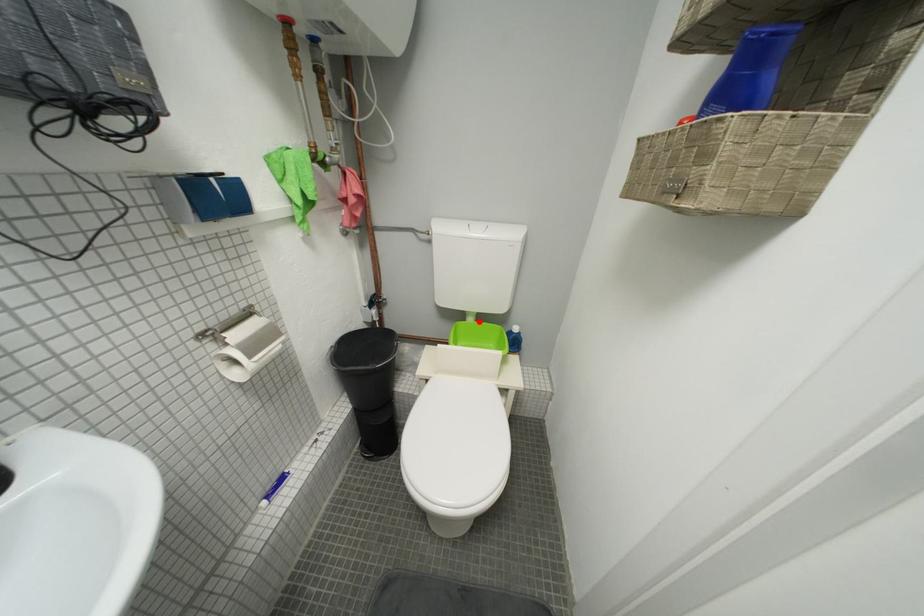
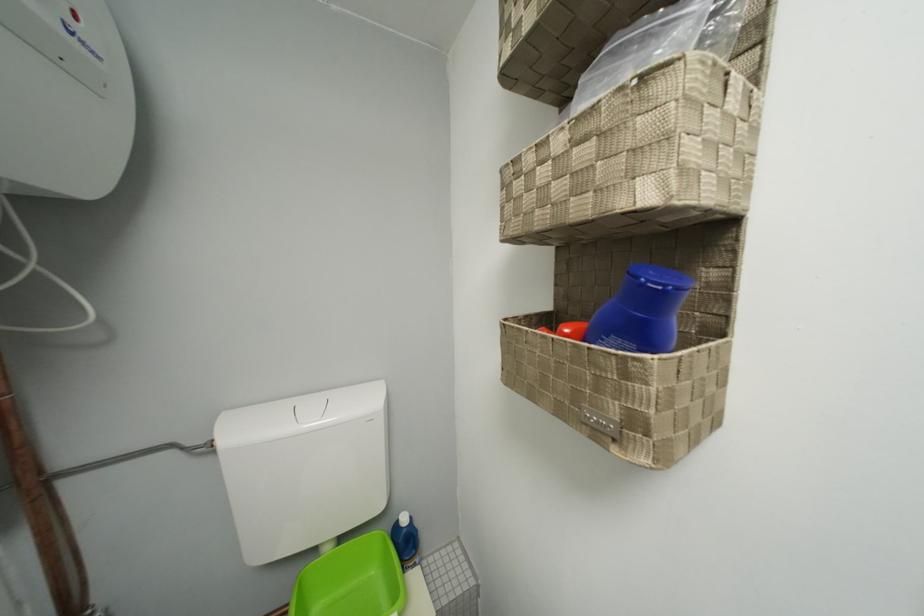
Find the pixel in the second image that matches the highlighted location in the first image.

(335, 552)